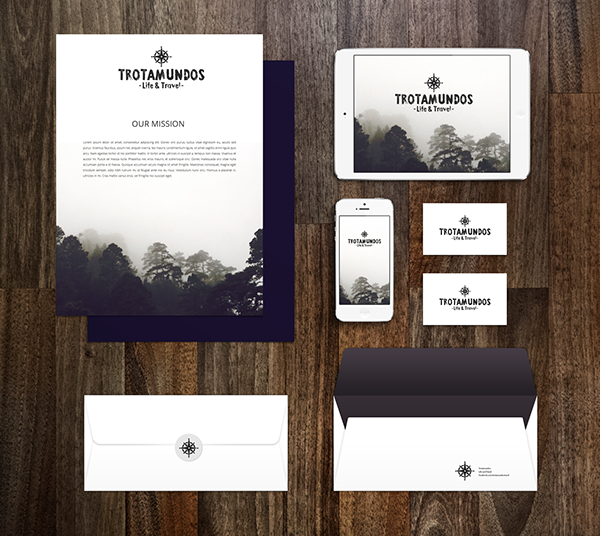
Locate an element on the screen. black interior is located at coordinates (434, 364).